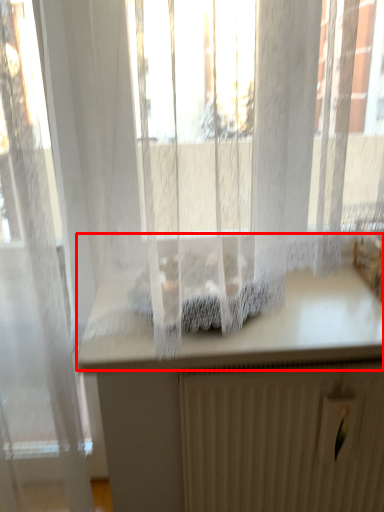
Question: From the image's perspective, considering the relative positions of counter top (annotated by the red box) and radiator in the image provided, where is counter top (annotated by the red box) located with respect to the staircase?

Choices:
 (A) below
 (B) above

Answer: (B)